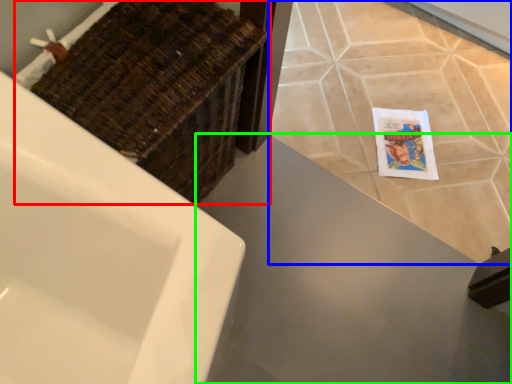
Question: Which object is the farthest from basket (highlighted by a red box)? Choose among these: ceramic tile (highlighted by a blue box) or counter top (highlighted by a green box).

Choices:
 (A) ceramic tile
 (B) counter top

Answer: (A)